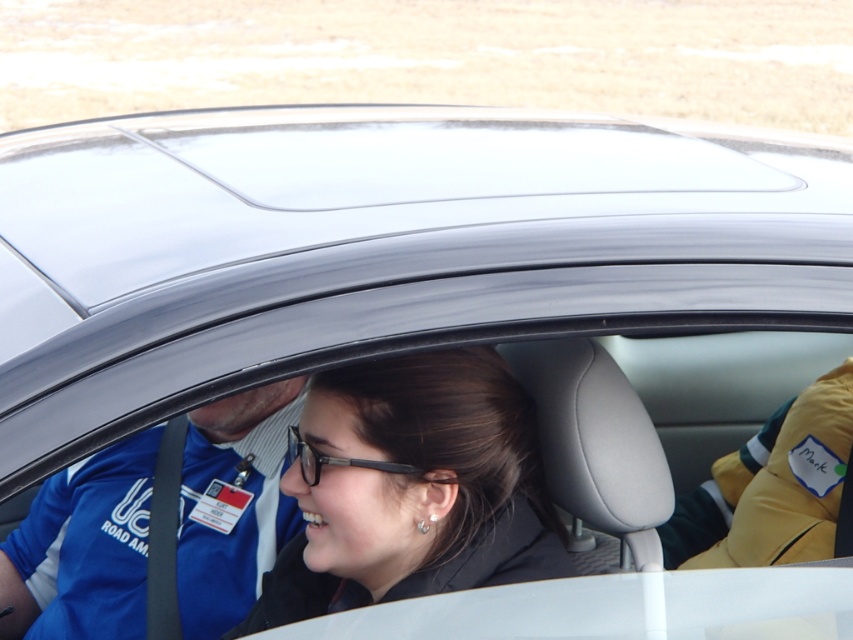
Does point (28, 560) come in front of point (294, 456)?

No, it is behind (294, 456).

Does blue fabric shirt at left appear under black plastic glasses at center?

Yes.

Describe the element at coordinates (83, 548) in the screenshot. I see `blue fabric shirt at left` at that location.

Identify the location of blue fabric shirt at left. Image resolution: width=853 pixels, height=640 pixels. (83, 548).

Does matte black hair at center appear on the left side of black plastic glasses at center?

In fact, matte black hair at center is to the right of black plastic glasses at center.

The height and width of the screenshot is (640, 853). What are the coordinates of `matte black hair at center` in the screenshot? It's located at (410, 488).

Who is positioned more to the left, matte black hair at center or blue fabric shirt at left?

blue fabric shirt at left

Does matte black hair at center have a greater width compared to blue fabric shirt at left?

Incorrect, matte black hair at center's width does not surpass blue fabric shirt at left's.

Is point (370, 522) more distant than point (196, 515)?

No, (370, 522) is in front of (196, 515).

The image size is (853, 640). I want to click on matte black hair at center, so click(x=410, y=488).